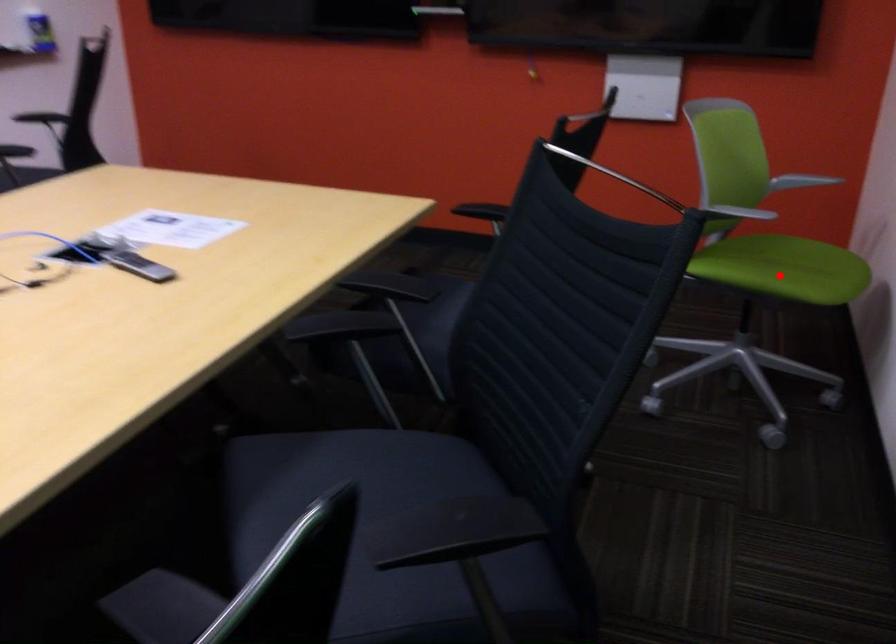
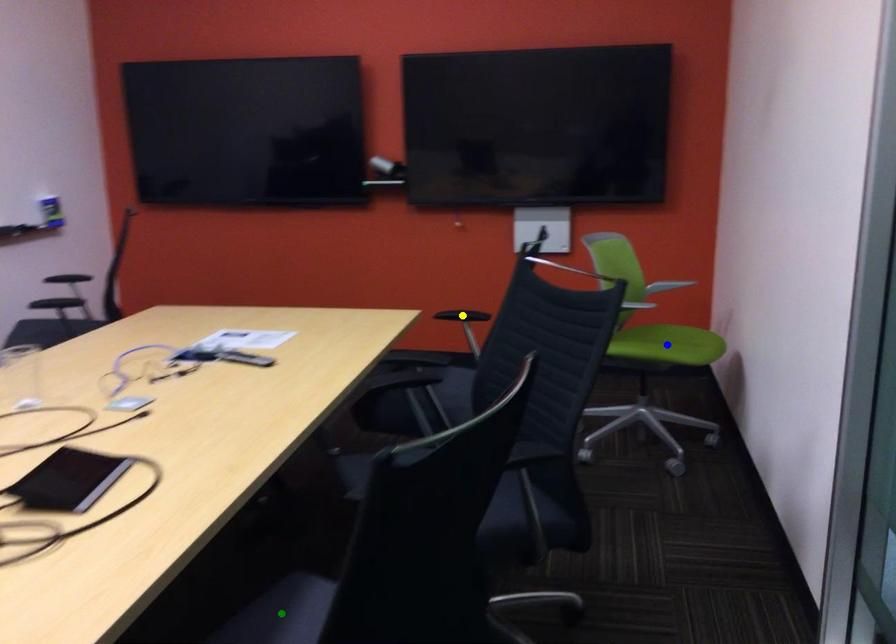
Question: I am providing you with two images of the same scene from different viewpoints. A red point is marked on the first image. You are given multiple points on the second image. Which point in image 2 represents the same 3d spot as the red point in image 1?

Choices:
 (A) yellow point
 (B) green point
 (C) blue point

Answer: (C)